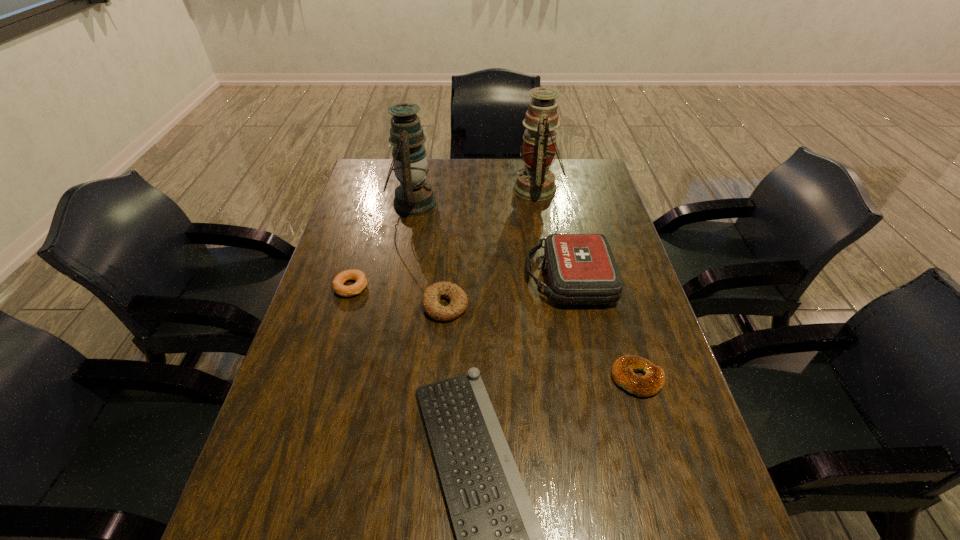
Where is `free location at the left edge`? This screenshot has height=540, width=960. free location at the left edge is located at coordinates (342, 234).

In order to click on vacant space at the right edge of the desktop in this screenshot , I will do `click(599, 329)`.

At what (x,y) coordinates should I click in order to perform the action: click on blank area at the far left corner. Please return your answer as a coordinate pair (x, y). The width and height of the screenshot is (960, 540). Looking at the image, I should click on (393, 184).

I want to click on unoccupied area between the rightmost bagel and the left oil lamp, so click(525, 291).

Find the location of a particular element. This screenshot has width=960, height=540. free space between the fifth shortest object and the left oil lamp is located at coordinates (491, 241).

At what (x,y) coordinates should I click in order to perform the action: click on blank region between the left oil lamp and the second bagel from left to right. Please return your answer as a coordinate pair (x, y). The width and height of the screenshot is (960, 540). Looking at the image, I should click on pyautogui.click(x=429, y=254).

Image resolution: width=960 pixels, height=540 pixels. I want to click on vacant area that lies between the left oil lamp and the first-aid kit, so click(491, 241).

In order to click on free space that is in between the leftmost bagel and the right oil lamp in this screenshot , I will do `click(444, 238)`.

Where is `empty space between the leftmost bagel and the left oil lamp`? This screenshot has width=960, height=540. empty space between the leftmost bagel and the left oil lamp is located at coordinates (382, 245).

What are the coordinates of `vacant space in between the rightmost bagel and the third tallest object` in the screenshot? It's located at (603, 328).